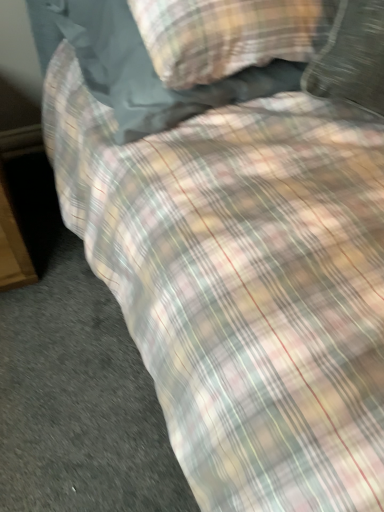
This screenshot has width=384, height=512. What do you see at coordinates (148, 70) in the screenshot?
I see `plaid fabric pillow at upper center` at bounding box center [148, 70].

Locate an element on the screen. plaid fabric pillow at upper center is located at coordinates (148, 70).

At what (x,y) coordinates should I click in order to perform the action: click on plaid fabric pillow at upper center. Please return your answer as a coordinate pair (x, y). The height and width of the screenshot is (512, 384). Looking at the image, I should click on (148, 70).